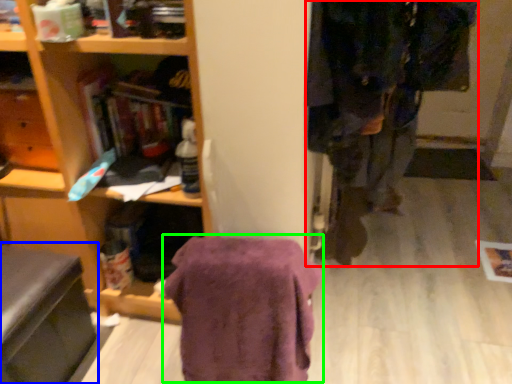
Question: Considering the real-world distances, which object is closest to clothing (highlighted by a red box)? swivel chair (highlighted by a blue box) or blanket (highlighted by a green box).

Choices:
 (A) swivel chair
 (B) blanket

Answer: (B)